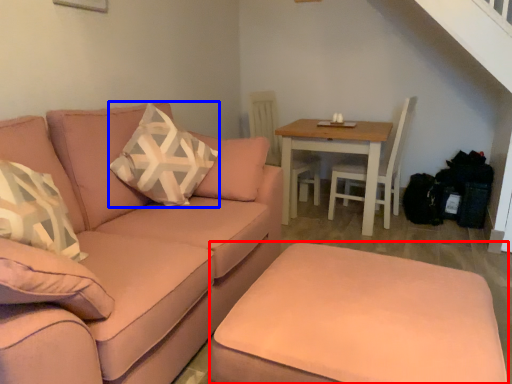
Question: Which point is closer to the camera, footrest (highlighted by a red box) or throw pillow (highlighted by a blue box)?

Choices:
 (A) footrest
 (B) throw pillow

Answer: (A)